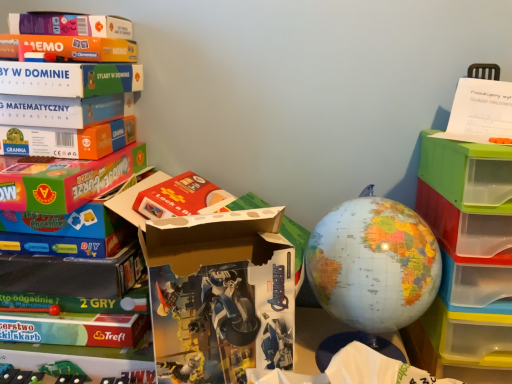
Question: Does translucent plastic drawers at right have a smaller size compared to matte plastic globe at center?

Choices:
 (A) no
 (B) yes

Answer: (A)

Question: From a real-world perspective, does translucent plastic drawers at right stand above matte plastic globe at center?

Choices:
 (A) yes
 (B) no

Answer: (B)

Question: From the image's perspective, does translucent plastic drawers at right appear higher than matte plastic globe at center?

Choices:
 (A) yes
 (B) no

Answer: (B)

Question: Considering the relative sizes of translucent plastic drawers at right and matte plastic globe at center in the image provided, is translucent plastic drawers at right bigger than matte plastic globe at center?

Choices:
 (A) yes
 (B) no

Answer: (A)

Question: Is translucent plastic drawers at right behind matte plastic globe at center?

Choices:
 (A) no
 (B) yes

Answer: (A)

Question: Is translucent plastic drawers at right at the right side of matte plastic globe at center?

Choices:
 (A) yes
 (B) no

Answer: (A)

Question: Is white paper at upper right inside matte plastic globe at center?

Choices:
 (A) no
 (B) yes

Answer: (A)

Question: Considering the relative sizes of matte plastic globe at center and white paper at upper right in the image provided, is matte plastic globe at center bigger than white paper at upper right?

Choices:
 (A) no
 (B) yes

Answer: (B)

Question: Can you confirm if matte plastic globe at center is positioned to the right of white paper at upper right?

Choices:
 (A) yes
 (B) no

Answer: (B)

Question: From a real-world perspective, is matte plastic globe at center located beneath white paper at upper right?

Choices:
 (A) no
 (B) yes

Answer: (B)

Question: Considering the relative sizes of matte plastic globe at center and white paper at upper right in the image provided, is matte plastic globe at center taller than white paper at upper right?

Choices:
 (A) yes
 (B) no

Answer: (A)

Question: Is matte plastic globe at center far away from white paper at upper right?

Choices:
 (A) no
 (B) yes

Answer: (A)

Question: Is matte plastic globe at center to the left of translucent plastic drawers at right from the viewer's perspective?

Choices:
 (A) no
 (B) yes

Answer: (B)